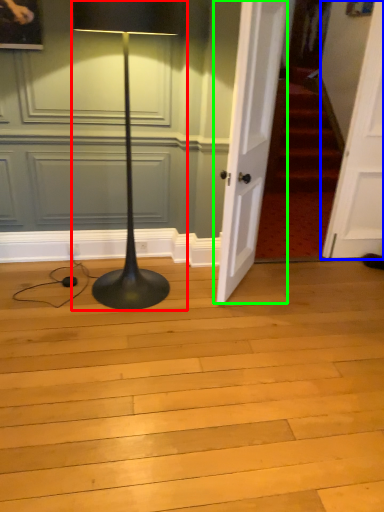
Question: Which object is positioned farthest from lamp (highlighted by a red box)? Select from door (highlighted by a blue box) and door (highlighted by a green box).

Choices:
 (A) door
 (B) door

Answer: (A)